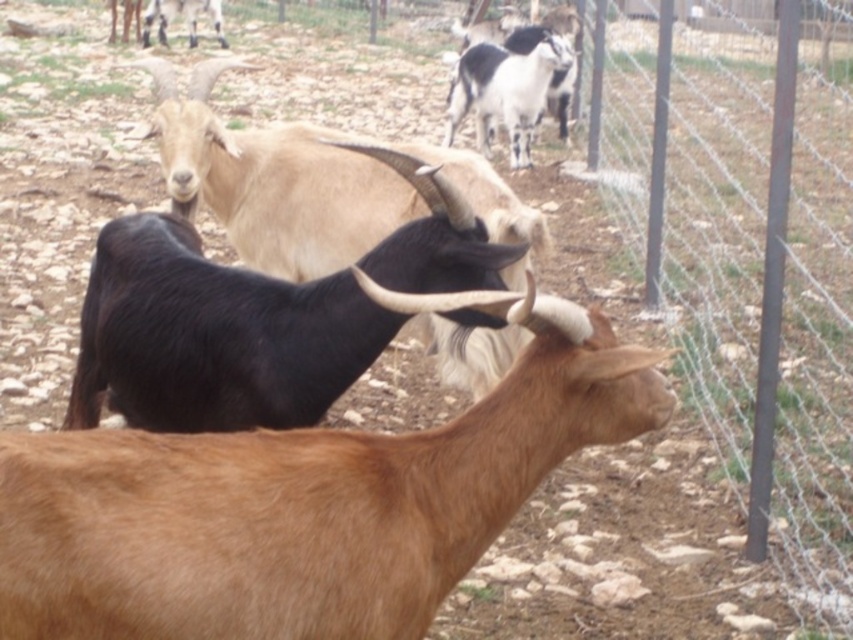
Consider the image. You are standing at the entrance of the enclosure and see the point marked at coordinates (x=306, y=499). Which goat is located at that point?

The point marked at coordinates (x=306, y=499) is located at the black matte goat at center.

You are a farmer who wants to separate the white and black fur at upper center from the light brown woolen goat at upper center. Which one should you move first to allow space for the other to pass through?

The white and black fur at upper center is positioned under the light brown woolen goat at upper center. To allow space for the other to pass through, you should move the light brown woolen goat at upper center first since it is above the white and black fur at upper center.